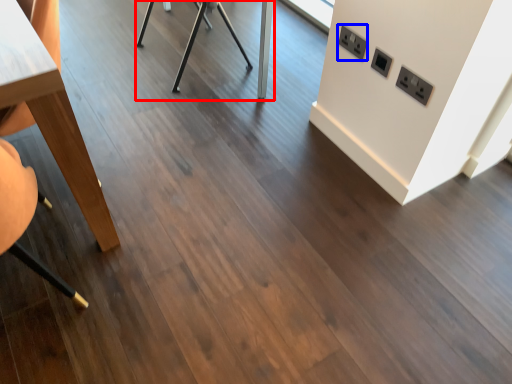
Question: Which object appears farthest to the camera in this image, table (highlighted by a red box) or electric outlet (highlighted by a blue box)?

Choices:
 (A) table
 (B) electric outlet

Answer: (A)